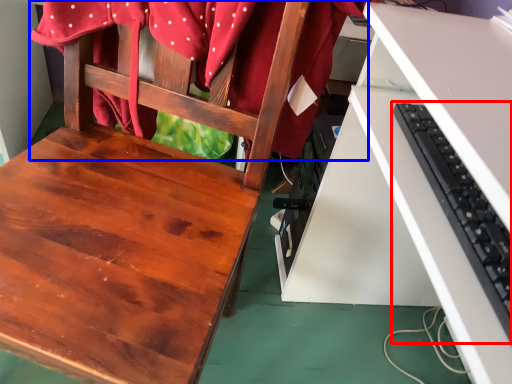
Question: Which point is closer to the camera, computer keyboard (highlighted by a red box) or fabric (highlighted by a blue box)?

Choices:
 (A) computer keyboard
 (B) fabric

Answer: (A)